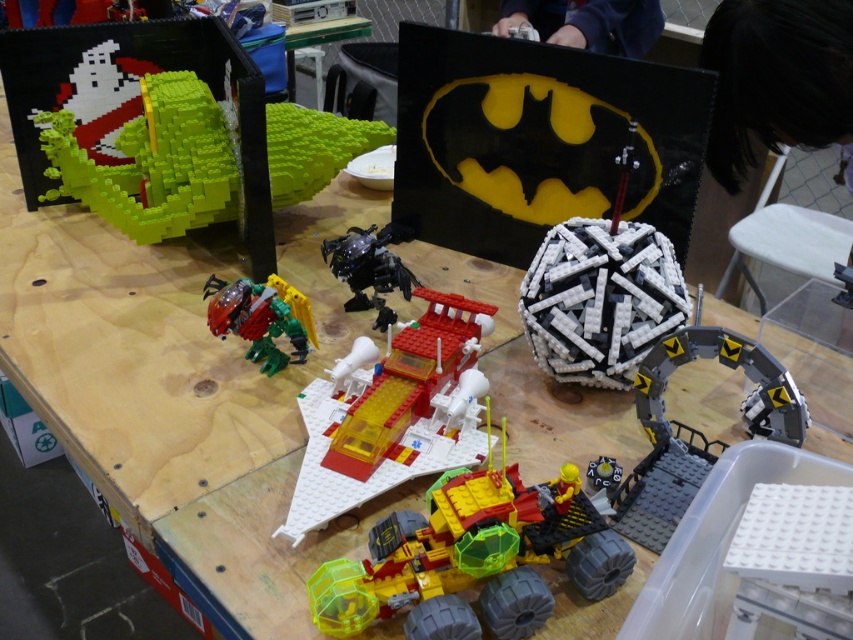
Can you confirm if white plastic plate at lower right is thinner than black plastic robot at center?

Correct, white plastic plate at lower right's width is less than black plastic robot at center's.

Can you confirm if white plastic plate at lower right is positioned above black plastic robot at center?

Incorrect, white plastic plate at lower right is not positioned above black plastic robot at center.

Between point (770, 522) and point (364, 244), which one is positioned in front?

Point (770, 522)

You are a GUI agent. You are given a task and a screenshot of the screen. Output one action in this format:
    pyautogui.click(x=<x>, y=<y>)
    Task: Click on the white plastic plate at lower right
    
    Given the screenshot: What is the action you would take?
    pyautogui.click(x=793, y=561)

Does green matte ghost at upper left appear over metallic red robot at center?

Correct, green matte ghost at upper left is located above metallic red robot at center.

Which of these two, green matte ghost at upper left or metallic red robot at center, stands shorter?

Standing shorter between the two is metallic red robot at center.

Is point (218, 218) less distant than point (265, 317)?

No, (218, 218) is behind (265, 317).

I want to click on green matte ghost at upper left, so click(x=152, y=163).

Does brick-like yellow-green vehicle at center have a smaller size compared to green matte ghost at upper left?

Indeed, brick-like yellow-green vehicle at center has a smaller size compared to green matte ghost at upper left.

Measure the distance between brick-like yellow-green vehicle at center and camera.

brick-like yellow-green vehicle at center is 26.42 inches away from camera.

Who is more distant from viewer, [476,572] or [216,134]?

The point [216,134] is more distant.

You are a GUI agent. You are given a task and a screenshot of the screen. Output one action in this format:
    pyautogui.click(x=<x>, y=<y>)
    Task: Click on the brick-like yellow-green vehicle at center
    
    Given the screenshot: What is the action you would take?
    pyautogui.click(x=473, y=557)